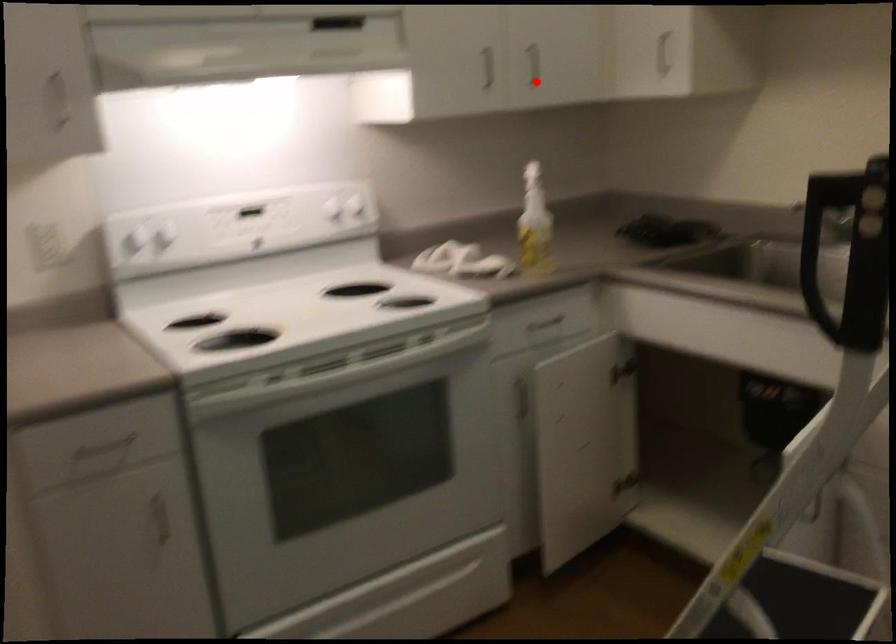
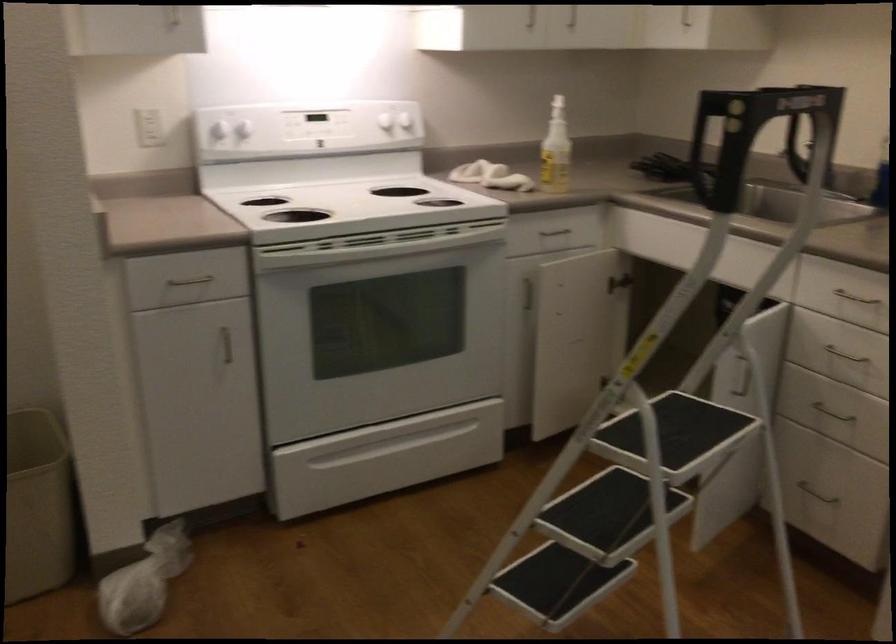
Question: I am providing you with two images of the same scene from different viewpoints. A red point is shown in image1. For the corresponding object point in image2, is it positioned nearer or farther from the camera?

Choices:
 (A) Nearer
 (B) Farther

Answer: (B)